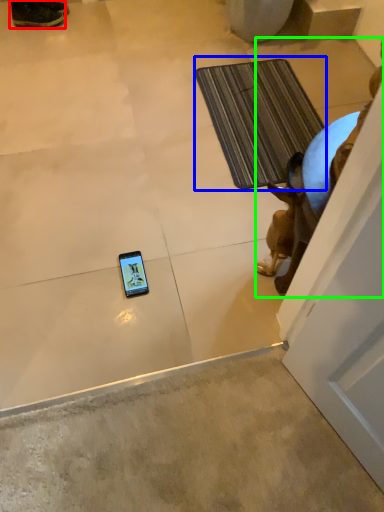
Question: Which is nearer to the footwear (highlighted by a red box)? bath mat (highlighted by a blue box) or animal (highlighted by a green box).

Choices:
 (A) bath mat
 (B) animal

Answer: (A)